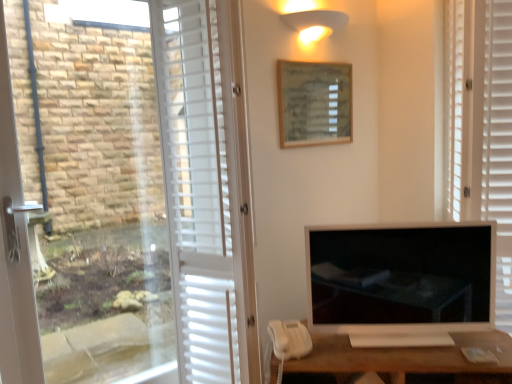
From the picture: What is the approximate height of white matte desk at lower right?

white matte desk at lower right is 14.53 inches tall.

The width and height of the screenshot is (512, 384). In order to click on white matte desk at lower right in this screenshot , I will do `click(404, 357)`.

What do you see at coordinates (401, 278) in the screenshot? I see `matte black monitor at center` at bounding box center [401, 278].

The width and height of the screenshot is (512, 384). Identify the location of white matte screen door at left. (198, 186).

The width and height of the screenshot is (512, 384). I want to click on wooden frame at upper center, so click(x=314, y=103).

This screenshot has height=384, width=512. In order to click on white matte desk at lower right in this screenshot , I will do `click(404, 357)`.

Can you tell me how much matte black monitor at center and white matte blind at right differ in facing direction?

The angular difference between matte black monitor at center and white matte blind at right is 31.9 degrees.

From the picture: Is matte black monitor at center next to white matte blind at right?

No, matte black monitor at center is not beside white matte blind at right.

How far apart are matte black monitor at center and white matte blind at right?

matte black monitor at center and white matte blind at right are 15.20 inches apart from each other.

From a real-world perspective, is matte black monitor at center located beneath white matte blind at right?

Yes, from a real-world perspective, matte black monitor at center is below white matte blind at right.

Which point is more distant from viewer, (324, 269) or (389, 348)?

The point (324, 269) is more distant.

Where is `television that is above the white matte desk at lower right (from the image's perspective)`? The width and height of the screenshot is (512, 384). television that is above the white matte desk at lower right (from the image's perspective) is located at coordinates (401, 278).

Based on the photo, is matte black monitor at center directly adjacent to white matte desk at lower right?

They are not placed beside each other.

From the image's perspective, is white matte screen door at left positioned above or below white matte blind at right?

From the image's perspective, white matte screen door at left appears below white matte blind at right.

In the scene shown: Between white matte screen door at left and white matte blind at right, which one has less height?

Standing shorter between the two is white matte screen door at left.

From a real-world perspective, is white matte screen door at left above or below white matte blind at right?

In terms of real-world spatial position, white matte screen door at left is above white matte blind at right.

Is white matte screen door at left smaller than white matte blind at right?

Yes, white matte screen door at left is smaller than white matte blind at right.

Considering the relative sizes of matte black monitor at center and white matte corded phone at lower center in the image provided, is matte black monitor at center shorter than white matte corded phone at lower center?

Incorrect, the height of matte black monitor at center does not fall short of that of white matte corded phone at lower center.

Which object is further away from the camera, matte black monitor at center or white matte corded phone at lower center?

Positioned behind is white matte corded phone at lower center.

From the image's perspective, is matte black monitor at center located above white matte corded phone at lower center?

Yes, from the image's perspective, matte black monitor at center is over white matte corded phone at lower center.

Which point is more forward, (290, 21) or (382, 309)?

The point (382, 309) is closer to the camera.

From a real-world perspective, who is located lower, warm matte wall sconce at upper center or matte black monitor at center?

From a 3D spatial view, matte black monitor at center is below.

Considering the relative sizes of warm matte wall sconce at upper center and matte black monitor at center in the image provided, is warm matte wall sconce at upper center shorter than matte black monitor at center?

Yes.

Can you confirm if warm matte wall sconce at upper center is wider than matte black monitor at center?

Correct, the width of warm matte wall sconce at upper center exceeds that of matte black monitor at center.

From the image's perspective, which one is positioned lower, white matte corded phone at lower center or warm matte wall sconce at upper center?

From the image's view, white matte corded phone at lower center is below.

Is white matte corded phone at lower center to the left or to the right of warm matte wall sconce at upper center in the image?

From the image, it's evident that white matte corded phone at lower center is to the left of warm matte wall sconce at upper center.

Is white matte corded phone at lower center placed right next to warm matte wall sconce at upper center?

white matte corded phone at lower center and warm matte wall sconce at upper center are clearly separated.

In the image, is white matte blind at right positioned in front of or behind warm matte wall sconce at upper center?

Clearly, white matte blind at right is in front of warm matte wall sconce at upper center.

Is white matte blind at right spatially inside warm matte wall sconce at upper center, or outside of it?

white matte blind at right is not enclosed by warm matte wall sconce at upper center.

Considering the relative sizes of white matte blind at right and warm matte wall sconce at upper center in the image provided, is white matte blind at right thinner than warm matte wall sconce at upper center?

Incorrect, the width of white matte blind at right is not less than that of warm matte wall sconce at upper center.

Is white matte blind at right bigger or smaller than warm matte wall sconce at upper center?

Considering their sizes, white matte blind at right takes up more space than warm matte wall sconce at upper center.

This screenshot has width=512, height=384. What are the coordinates of `television below the white matte blind at right (from a real-world perspective)` in the screenshot? It's located at (401, 278).

The image size is (512, 384). In order to click on television above the white matte desk at lower right (from the image's perspective) in this screenshot , I will do `click(401, 278)`.

Estimate the real-world distances between objects in this image. Which object is further from white matte corded phone at lower center, white matte screen door at left or wooden frame at upper center?

wooden frame at upper center.

When comparing their distances from white matte screen door at left, does matte black monitor at center or wooden frame at upper center seem further?

matte black monitor at center.

Based on their spatial positions, is white matte desk at lower right or white matte blind at right further from warm matte wall sconce at upper center?

white matte desk at lower right lies further to warm matte wall sconce at upper center than the other object.

Considering their positions, is white matte screen door at left positioned further to wooden frame at upper center than warm matte wall sconce at upper center?

Among the two, white matte screen door at left is located further to wooden frame at upper center.

Based on their spatial positions, is warm matte wall sconce at upper center or white matte corded phone at lower center further from matte black monitor at center?

Based on the image, warm matte wall sconce at upper center appears to be further to matte black monitor at center.

Estimate the real-world distances between objects in this image. Which object is closer to white matte screen door at left, white matte blind at right or white matte corded phone at lower center?

Based on the image, white matte corded phone at lower center appears to be nearer to white matte screen door at left.

Estimate the real-world distances between objects in this image. Which object is further from matte black monitor at center, white matte desk at lower right or white matte blind at right?

white matte blind at right is positioned further to the anchor matte black monitor at center.

From the image, which object appears to be farther from warm matte wall sconce at upper center, white matte blind at right or wooden frame at upper center?

white matte blind at right lies further to warm matte wall sconce at upper center than the other object.

Locate an element on the screen. corded phone between wooden frame at upper center and white matte desk at lower right in the vertical direction is located at coordinates (288, 341).

Identify the location of picture frame between warm matte wall sconce at upper center and white matte desk at lower right vertically. The height and width of the screenshot is (384, 512). (314, 103).

The height and width of the screenshot is (384, 512). Find the location of `blind between wooden frame at upper center and white matte corded phone at lower center in the vertical direction`. blind between wooden frame at upper center and white matte corded phone at lower center in the vertical direction is located at coordinates (480, 127).

This screenshot has height=384, width=512. In order to click on desk between white matte corded phone at lower center and white matte blind at right in this screenshot , I will do `click(404, 357)`.